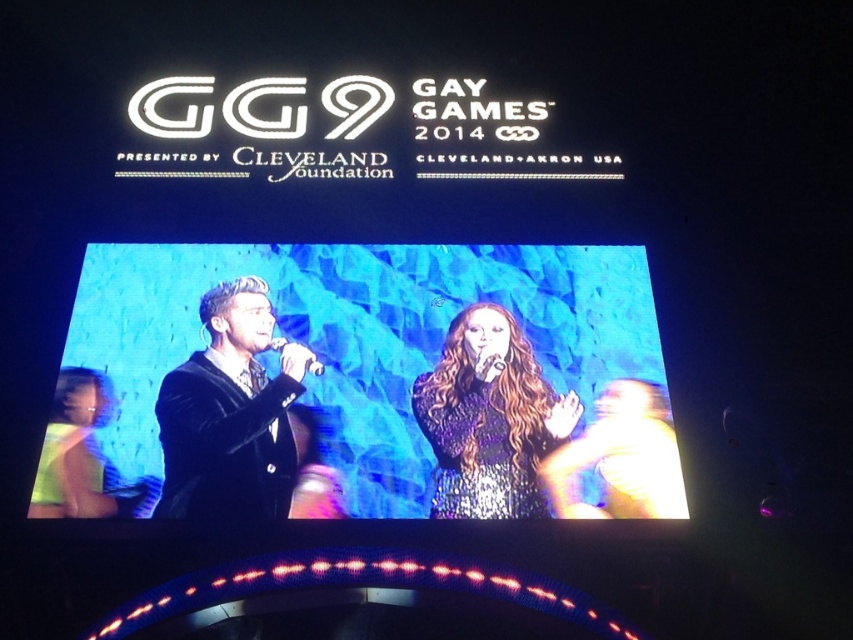
Is point (279, 349) less distant than point (498, 358)?

That is True.

Is point (310, 364) farther from viewer compared to point (502, 365)?

No, it is in front of (502, 365).

Which is behind, point (322, 371) or point (489, 360)?

The point (489, 360) is behind.

This screenshot has width=853, height=640. I want to click on white plastic microphone at center, so click(x=315, y=365).

Which is above, velvet black suit at center or shiny sequined dress at center?

velvet black suit at center is higher up.

Can you confirm if velvet black suit at center is positioned to the left of shiny sequined dress at center?

Correct, you'll find velvet black suit at center to the left of shiny sequined dress at center.

Does point (251, 294) come farther from viewer compared to point (457, 320)?

Yes, point (251, 294) is behind point (457, 320).

Locate an element on the screen. velvet black suit at center is located at coordinates (230, 413).

Is black velvet suit at center in front of shiny sequined dress at center?

Yes, black velvet suit at center is in front of shiny sequined dress at center.

Between black velvet suit at center and shiny sequined dress at center, which one appears on the right side from the viewer's perspective?

shiny sequined dress at center

Where is `black velvet suit at center`? The width and height of the screenshot is (853, 640). black velvet suit at center is located at coordinates 358,384.